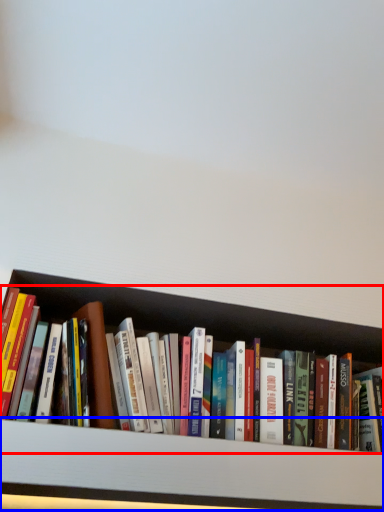
Question: Which point is closer to the camera, book (highlighted by a red box) or cabinet (highlighted by a blue box)?

Choices:
 (A) book
 (B) cabinet

Answer: (B)